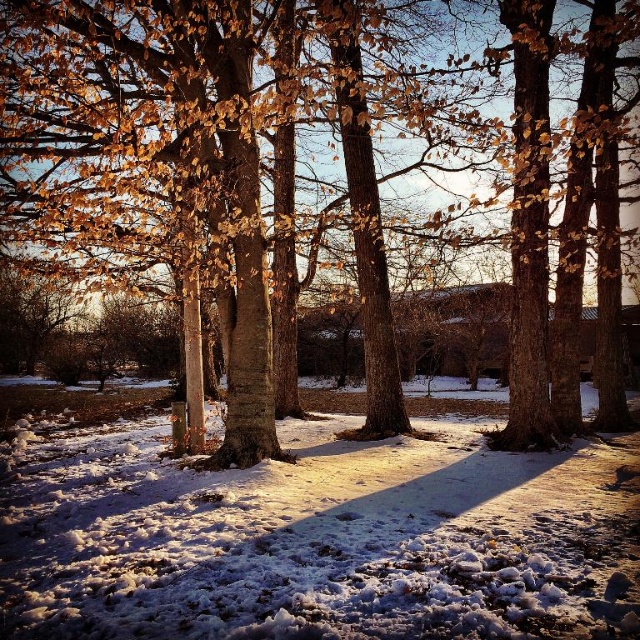
Based on the photo, you are standing in the winter scene and want to take a photo of both the brown textured bark at center and the white fluffy snow at center. Which object should you focus on first to ensure both are in clear view?

You should focus on the brown textured bark at center first because it is closer to you than the white fluffy snow at center, ensuring both will be in focus when focused on the closer object.

You are standing in the winter scene and want to place a small snowman exactly where the white fluffy snow at center is located. However, there is a tree trunk with brown textured bark at center nearby. Based on their positions, will the snowman be to the left or right of the tree trunk?

The brown textured bark at center is positioned on the right side of white fluffy snow at center, so the snowman will be to the left of the tree trunk.